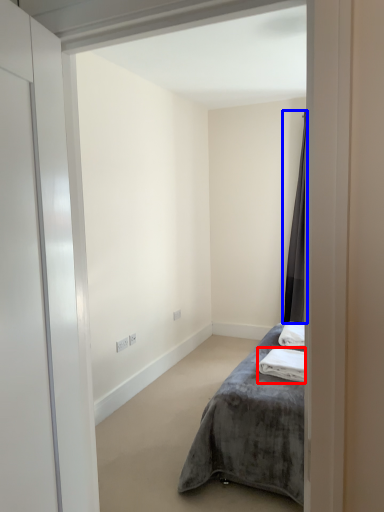
Question: Which object appears farthest to the camera in this image, bath towel (highlighted by a red box) or curtain (highlighted by a blue box)?

Choices:
 (A) bath towel
 (B) curtain

Answer: (B)